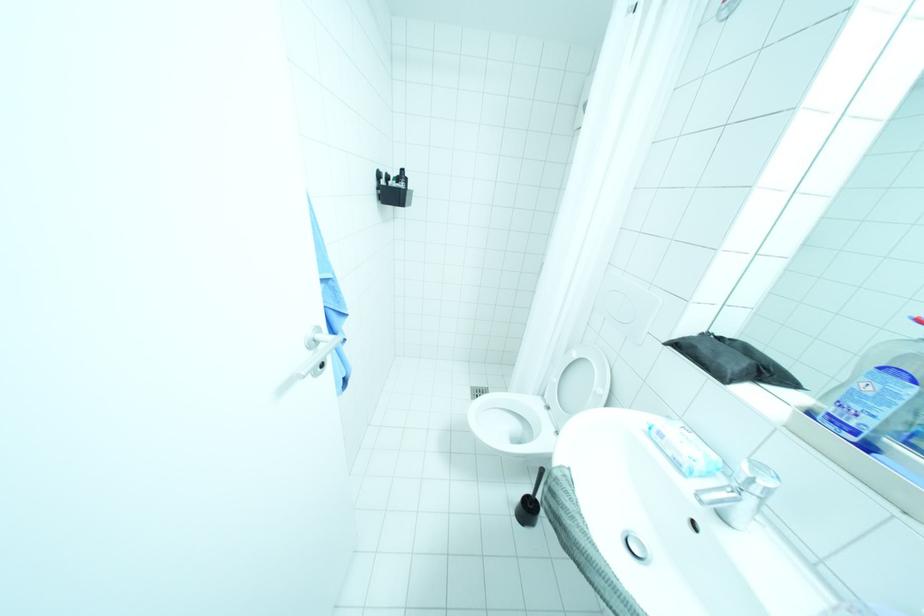
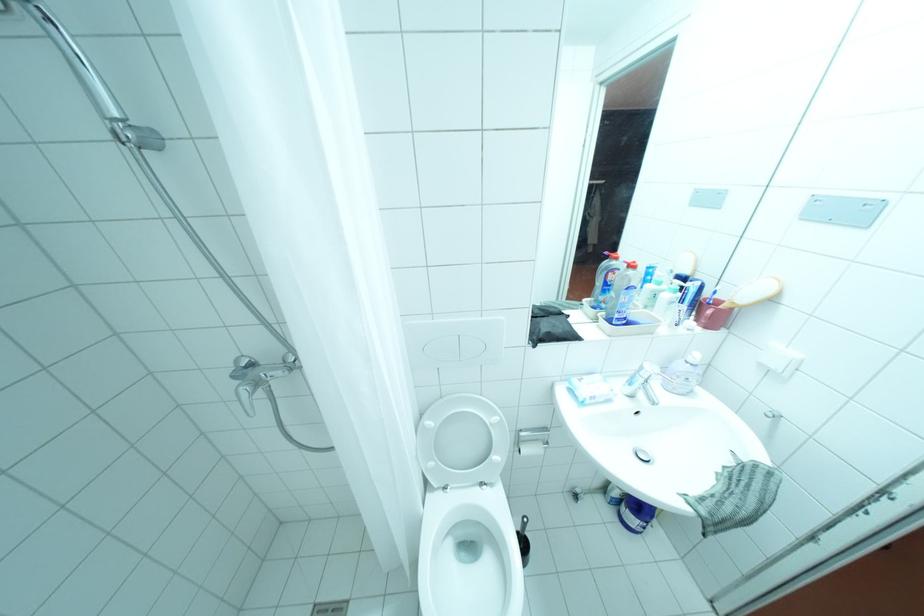
Based on the continuous images, in which direction is the camera rotating?

The rotation direction of the camera is right-down.